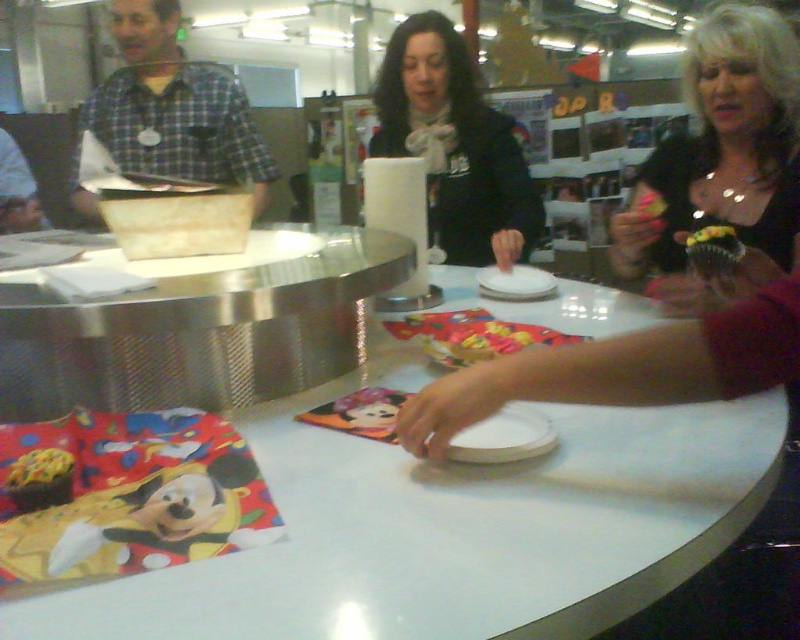
You are a customer at the bakery and want to grab both the black matte scarf at center and the green frosted cupcake at center right. Can you reach both items without moving your position? The counter is 24 inches wide at this section.

The distance between the black matte scarf at center and the green frosted cupcake at center right is 22.71 inches, which is less than the 24 inch width of the counter. Therefore, you can reach both items without moving your position.

You are a customer at the bakery and want to place your coffee on the white glossy table at center. However, you notice the plaid shirt at left nearby. Is the table tall enough to prevent your coffee from being knocked over by someone wearing the plaid shirt?

The white glossy table at center is shorter than the plaid shirt at left, so there is a risk the coffee could be knocked over if the person in the plaid shirt at left leans over the table.

You are standing in a bakery and want to take a photo of the shiny black dress at center. The camera you have can focus on objects up to 4 feet away. Will the dress be in focus?

The shiny black dress at center is 4.19 feet from the camera, which is beyond the 4 feet focus limit. Therefore, the dress will not be in focus.